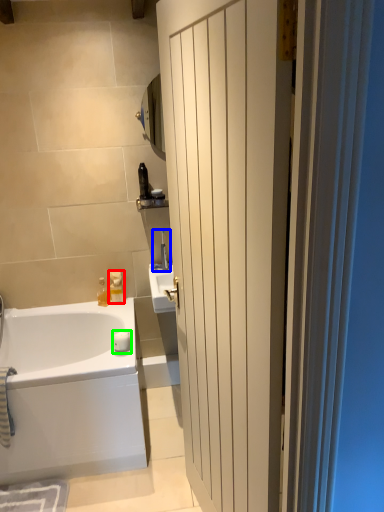
Question: Which object is positioned farthest from toiletry (highlighted by a red box)? Select from faucet (highlighted by a blue box) and soap (highlighted by a green box).

Choices:
 (A) faucet
 (B) soap

Answer: (A)